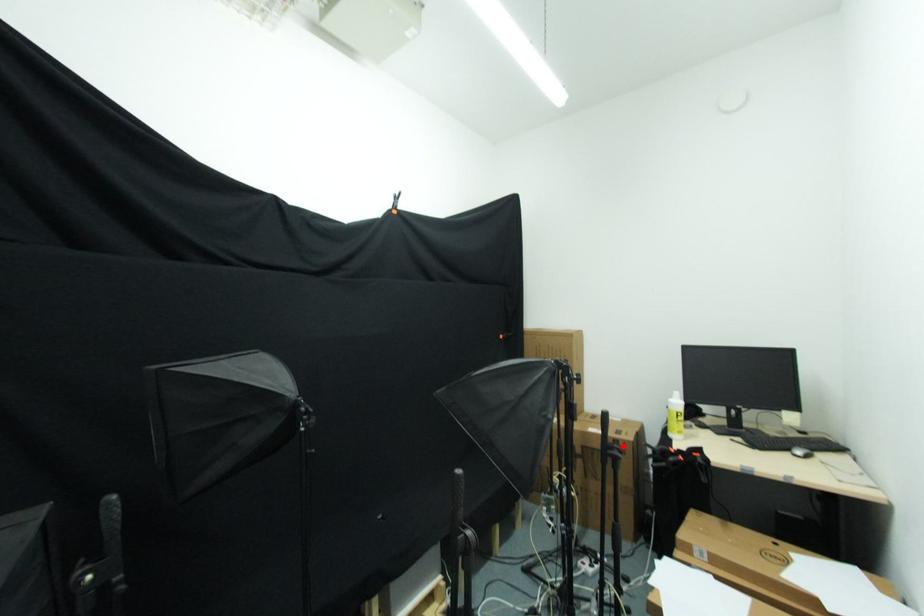
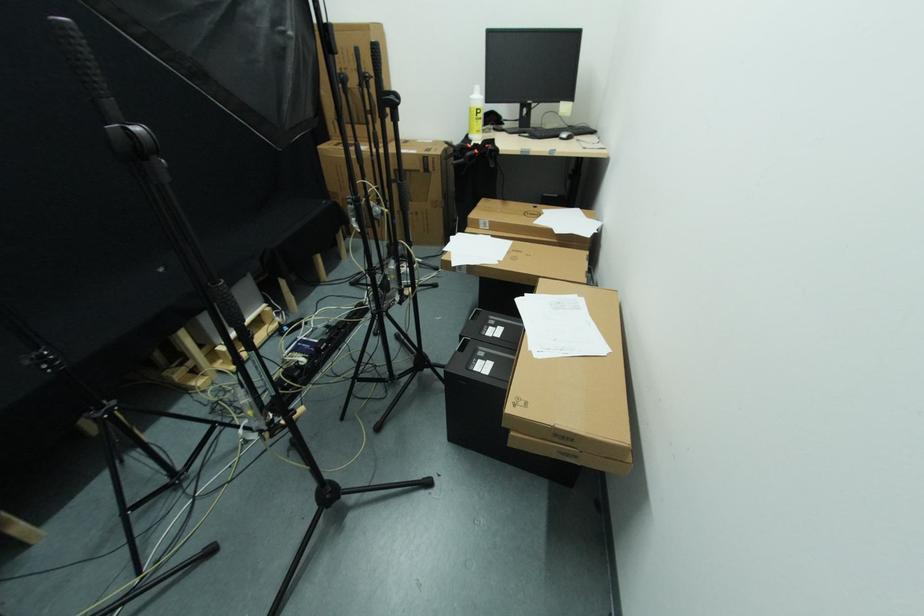
In the second image, find the point that corresponds to the highlighted location in the first image.

(432, 161)